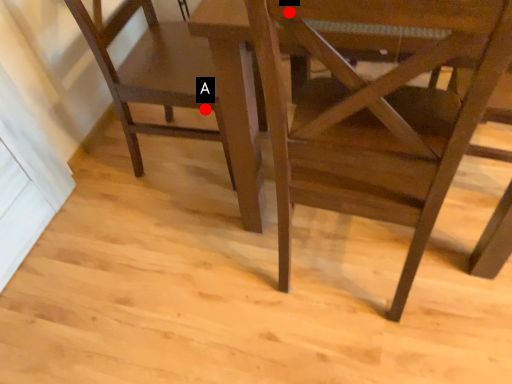
Question: Two points are circled on the image, labeled by A and B beside each circle. Which point is closer to the camera?

Choices:
 (A) A is closer
 (B) B is closer

Answer: (B)